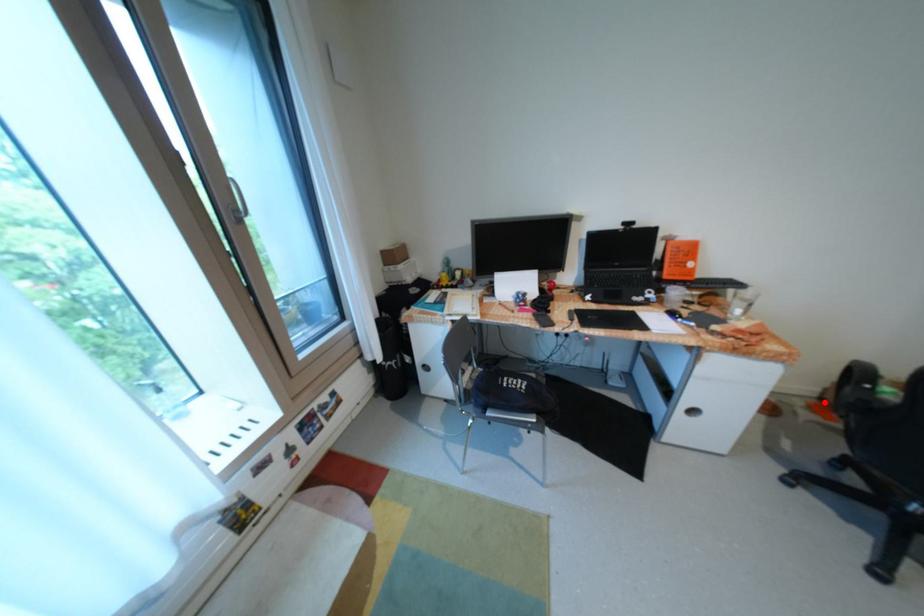
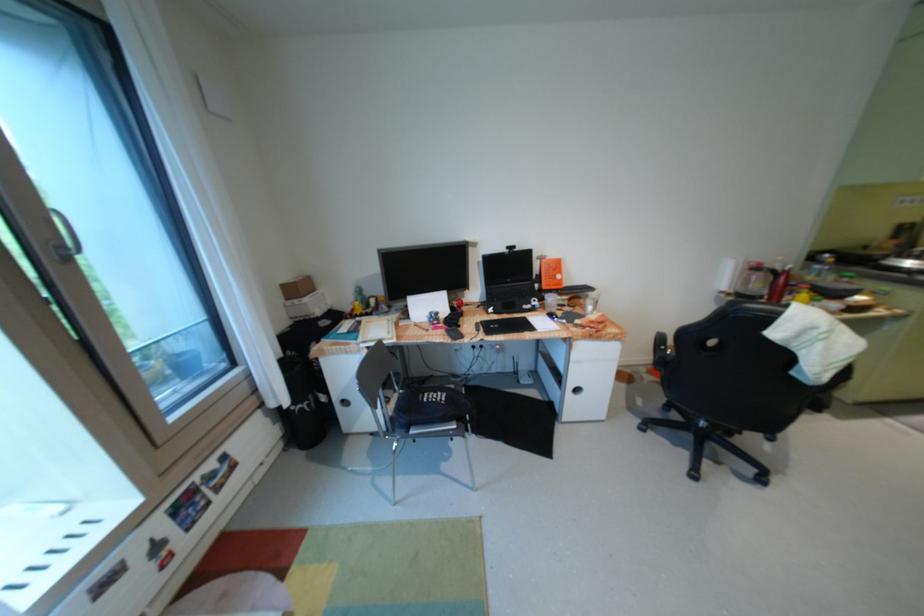
Find the pixel in the second image that matches the highlighted location in the first image.

(661, 368)